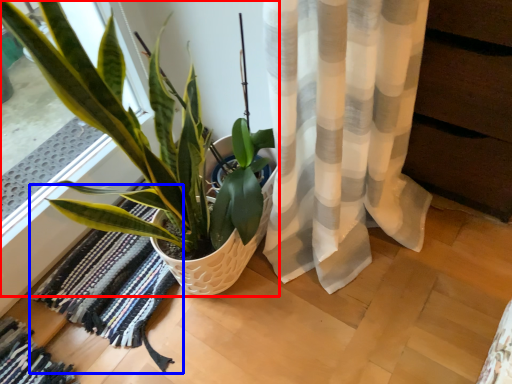
Question: Which of the following is the closest to the observer, houseplant (highlighted by a red box) or mat (highlighted by a blue box)?

Choices:
 (A) houseplant
 (B) mat

Answer: (A)